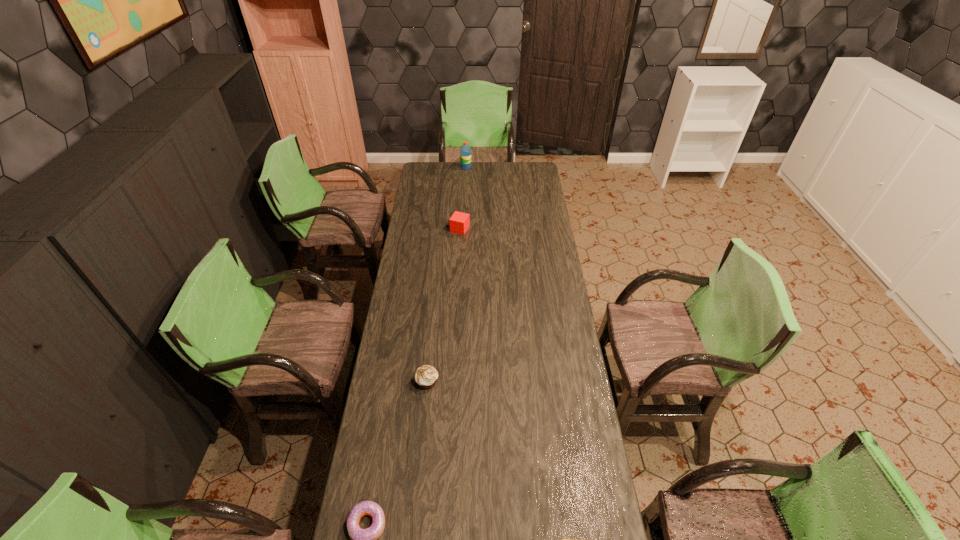
The image size is (960, 540). What are the coordinates of `vacant space at the left edge of the desktop` in the screenshot? It's located at (362, 460).

In the image, there is a desktop. Where is `blank space at the right edge`? The image size is (960, 540). blank space at the right edge is located at coordinates (540, 291).

Find the location of `free space at the far left corner of the desktop`. free space at the far left corner of the desktop is located at coordinates (424, 170).

Identify the location of vacant space that is in between the cube and the third farthest object. This screenshot has width=960, height=540. (444, 306).

The image size is (960, 540). I want to click on vacant area that lies between the third farthest object and the water bottle, so click(x=446, y=274).

Locate an element on the screen. The image size is (960, 540). vacant area between the cube and the tallest object is located at coordinates (463, 198).

Where is `empty space that is in between the cube and the tallest object`? This screenshot has height=540, width=960. empty space that is in between the cube and the tallest object is located at coordinates (463, 198).

Select which object appears as the closest to the fourth tallest object. Please provide its 2D coordinates. Your answer should be formatted as a tuple, i.e. [(x, y)], where the tuple contains the x and y coordinates of a point satisfying the conditions above.

[(361, 539)]

Find the location of a particular element. The image size is (960, 540). the fourth closest object to the tallest object is located at coordinates (562, 539).

This screenshot has width=960, height=540. Find the location of `free point that satisfies the following two spatial constraints: 1. on the front label of the water bottle; 2. on the front side of the cube`. free point that satisfies the following two spatial constraints: 1. on the front label of the water bottle; 2. on the front side of the cube is located at coordinates (464, 229).